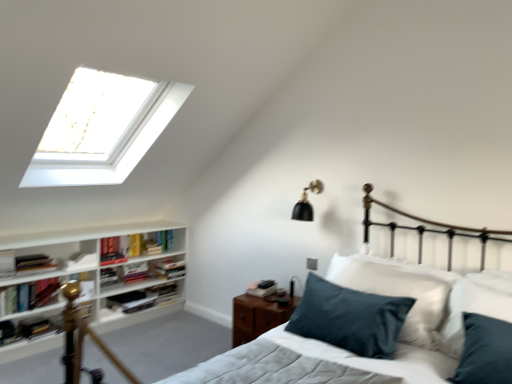
You are a GUI agent. You are given a task and a screenshot of the screen. Output one action in this format:
    pyautogui.click(x=<x>, y=<y>)
    Task: Click on the empty space that is ontop of wooden nightstand at lower right (from a real-world perspective)
    
    Given the screenshot: What is the action you would take?
    pyautogui.click(x=269, y=296)